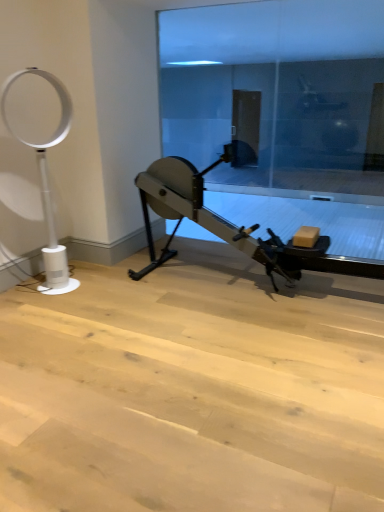
Question: Should I look upward or downward to see white plastic fan at left?

Choices:
 (A) down
 (B) up

Answer: (B)

Question: Is metallic gray stationary bicycle at center to the right of transparent glass door at center from the viewer's perspective?

Choices:
 (A) yes
 (B) no

Answer: (B)

Question: From a real-world perspective, is metallic gray stationary bicycle at center located beneath transparent glass door at center?

Choices:
 (A) no
 (B) yes

Answer: (B)

Question: Is metallic gray stationary bicycle at center smaller than transparent glass door at center?

Choices:
 (A) no
 (B) yes

Answer: (A)

Question: Considering the relative sizes of metallic gray stationary bicycle at center and transparent glass door at center in the image provided, is metallic gray stationary bicycle at center wider than transparent glass door at center?

Choices:
 (A) no
 (B) yes

Answer: (B)

Question: Is the depth of metallic gray stationary bicycle at center less than that of transparent glass door at center?

Choices:
 (A) no
 (B) yes

Answer: (B)

Question: Can you confirm if metallic gray stationary bicycle at center is thinner than transparent glass door at center?

Choices:
 (A) yes
 (B) no

Answer: (B)

Question: Is the position of transparent glass door at center more distant than that of white plastic fan at left?

Choices:
 (A) no
 (B) yes

Answer: (B)

Question: Are transparent glass door at center and white plastic fan at left far apart?

Choices:
 (A) no
 (B) yes

Answer: (B)

Question: From the image's perspective, is transparent glass door at center on top of white plastic fan at left?

Choices:
 (A) yes
 (B) no

Answer: (A)

Question: Is transparent glass door at center closer to the viewer compared to white plastic fan at left?

Choices:
 (A) yes
 (B) no

Answer: (B)

Question: From a real-world perspective, is transparent glass door at center over white plastic fan at left?

Choices:
 (A) no
 (B) yes

Answer: (B)

Question: Is transparent glass door at center located outside white plastic fan at left?

Choices:
 (A) yes
 (B) no

Answer: (A)

Question: Is transparent glass door at center smaller than metallic gray stationary bicycle at center?

Choices:
 (A) no
 (B) yes

Answer: (B)